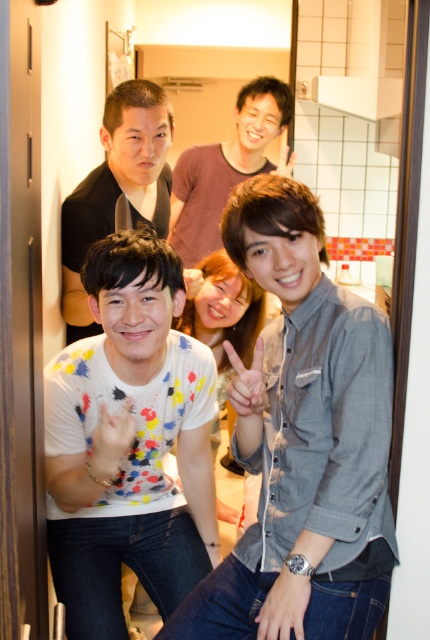
Between gray cotton shirt at center and matte gray shirt at center, which one is positioned higher?

matte gray shirt at center is higher up.

Can you confirm if gray cotton shirt at center is smaller than matte gray shirt at center?

Yes.

What do you see at coordinates (303, 442) in the screenshot?
I see `gray cotton shirt at center` at bounding box center [303, 442].

Where is `gray cotton shirt at center`? The width and height of the screenshot is (430, 640). gray cotton shirt at center is located at coordinates (303, 442).

Is gray cotton shirt at center taller than white paint splattered shirt at center?

Yes, gray cotton shirt at center is taller than white paint splattered shirt at center.

Is point (307, 433) positioned before point (169, 252)?

Yes, point (307, 433) is in front of point (169, 252).

Does point (297, 472) lie behind point (137, 362)?

That is False.

The width and height of the screenshot is (430, 640). Identify the location of gray cotton shirt at center. (303, 442).

Can you confirm if black matte shirt at upper center is wider than matte gray shirt at center?

In fact, black matte shirt at upper center might be narrower than matte gray shirt at center.

Does point (169, 141) come in front of point (254, 156)?

Yes, point (169, 141) is in front of point (254, 156).

Which is in front, point (67, 328) or point (196, 157)?

Point (67, 328) is in front.

You are a GUI agent. You are given a task and a screenshot of the screen. Output one action in this format:
    pyautogui.click(x=<x>, y=<y>)
    Task: Click on the black matte shirt at upper center
    
    Given the screenshot: What is the action you would take?
    pyautogui.click(x=116, y=188)